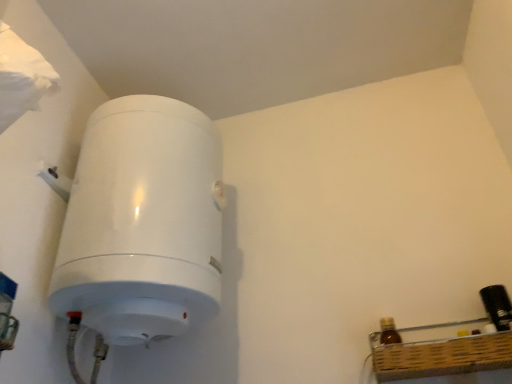
Question: Can you confirm if white glossy water heater at left is taller than black plastic bottle at right, marked as the first bottle in a right-to-left arrangement?

Choices:
 (A) yes
 (B) no

Answer: (A)

Question: Is the depth of white glossy water heater at left greater than that of black plastic bottle at right, marked as the first bottle in a right-to-left arrangement?

Choices:
 (A) yes
 (B) no

Answer: (B)

Question: Can you confirm if white glossy water heater at left is bigger than black plastic bottle at right, marked as the first bottle in a right-to-left arrangement?

Choices:
 (A) no
 (B) yes

Answer: (B)

Question: Is white glossy water heater at left outside black plastic bottle at right, the second bottle in the left-to-right sequence?

Choices:
 (A) no
 (B) yes

Answer: (B)

Question: Can you confirm if white glossy water heater at left is positioned to the right of black plastic bottle at right, marked as the first bottle in a right-to-left arrangement?

Choices:
 (A) yes
 (B) no

Answer: (B)

Question: Can you confirm if white glossy water heater at left is thinner than black plastic bottle at right, marked as the first bottle in a right-to-left arrangement?

Choices:
 (A) no
 (B) yes

Answer: (A)

Question: From the image's perspective, is white glossy water heater at left beneath brown glass bottle at lower right, which appears as the 2th bottle when viewed from the right?

Choices:
 (A) no
 (B) yes

Answer: (A)

Question: Does white glossy water heater at left lie in front of brown glass bottle at lower right, which appears as the 2th bottle when viewed from the right?

Choices:
 (A) no
 (B) yes

Answer: (B)

Question: Considering the relative sizes of white glossy water heater at left and brown glass bottle at lower right, which appears as the 2th bottle when viewed from the right, in the image provided, is white glossy water heater at left thinner than brown glass bottle at lower right, which appears as the 2th bottle when viewed from the right,?

Choices:
 (A) yes
 (B) no

Answer: (B)

Question: From the image's perspective, is white glossy water heater at left located above brown glass bottle at lower right, which appears as the 1th bottle when viewed from the left?

Choices:
 (A) no
 (B) yes

Answer: (B)

Question: Considering the relative sizes of white glossy water heater at left and brown glass bottle at lower right, which appears as the 2th bottle when viewed from the right, in the image provided, is white glossy water heater at left bigger than brown glass bottle at lower right, which appears as the 2th bottle when viewed from the right,?

Choices:
 (A) yes
 (B) no

Answer: (A)

Question: Is white glossy water heater at left positioned with its back to brown glass bottle at lower right, which appears as the 2th bottle when viewed from the right?

Choices:
 (A) yes
 (B) no

Answer: (B)

Question: Is brown glass bottle at lower right, which appears as the 2th bottle when viewed from the right, positioned far away from white glossy water heater at left?

Choices:
 (A) no
 (B) yes

Answer: (A)